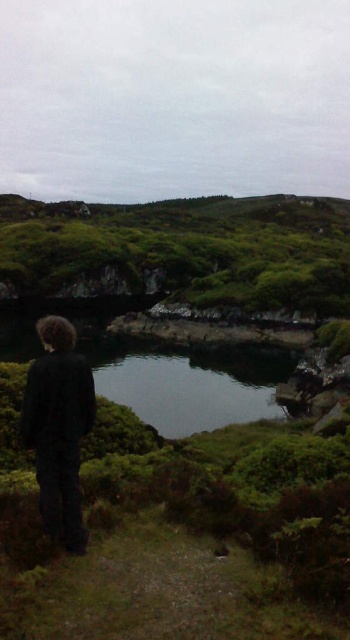
Is point (98, 356) farther from viewer compared to point (70, 355)?

Yes, point (98, 356) is farther from viewer.

Is point (114, 352) in front of point (80, 442)?

No, (114, 352) is behind (80, 442).

Describe the element at coordinates (190, 381) in the screenshot. I see `clear water at center` at that location.

Identify the location of clear water at center. (190, 381).